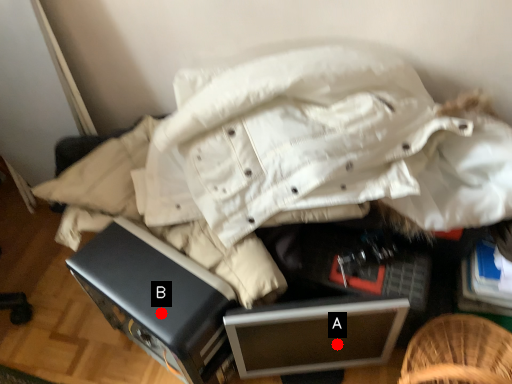
Question: Two points are circled on the image, labeled by A and B beside each circle. Among these points, which one is farthest from the camera?

Choices:
 (A) A is further
 (B) B is further

Answer: (A)